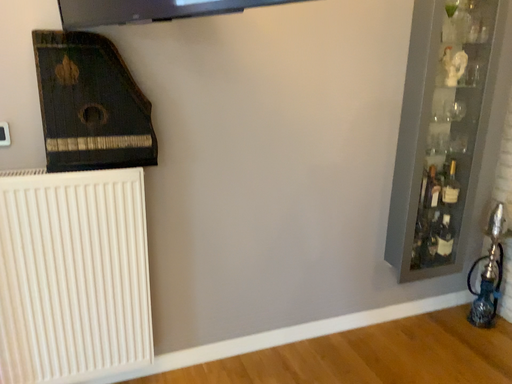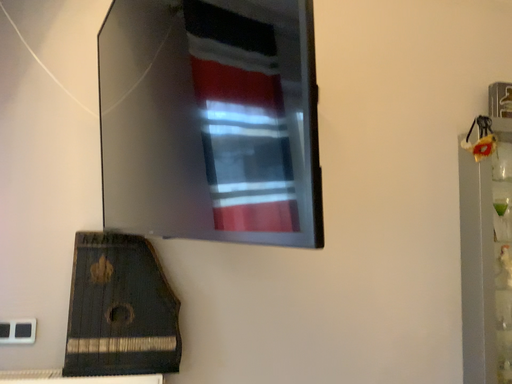
Question: Which way did the camera rotate in the video?

Choices:
 (A) rotated right
 (B) rotated left

Answer: (B)